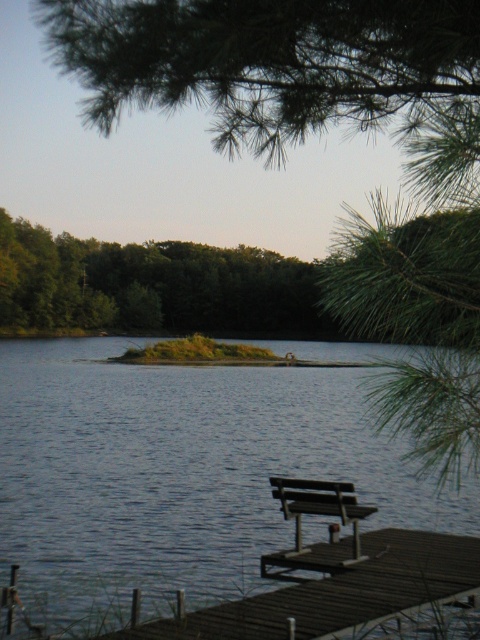
You are standing at the end of the dock and looking towards the island. There are two points marked in the scene, point (106, 605) and point (356, 564). Which point is closer to you?

Point (106, 605) is further to the camera than point (356, 564), so the point closer to you is point (356, 564).

You are planning to take a photo of the green leafy tree at center and the dark brown wood dock at lower right. Which object should you focus on first if you want to capture both in a single frame without moving the camera?

The green leafy tree at center is larger in size than the dark brown wood dock at lower right, so you should focus on the green leafy tree at center first to ensure it fills the frame appropriately before adjusting for the smaller dock.